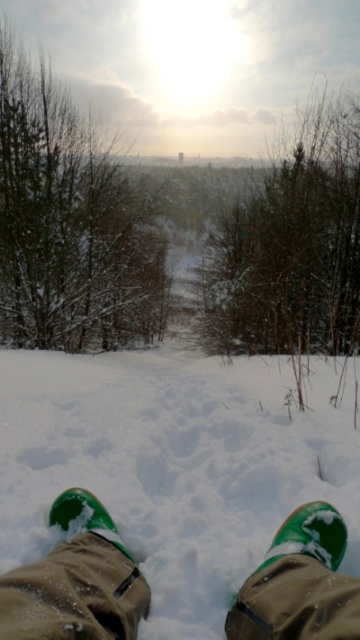
Question: Which of the following is the farthest from the observer?

Choices:
 (A) green suede boot at lower center
 (B) green suede boots at lower center

Answer: (A)

Question: Observing the image, what is the correct spatial positioning of green suede boots at lower center in reference to green suede shoe at lower center?

Choices:
 (A) above
 (B) below

Answer: (A)

Question: Which point is closer to the camera?

Choices:
 (A) green suede boots at lower center
 (B) green suede shoe at lower center

Answer: (A)

Question: Which object is the closest to the green suede boot at lower center?

Choices:
 (A) green suede boots at lower center
 (B) green suede shoe at lower center

Answer: (A)

Question: Does green suede boots at lower center appear under green suede boot at lower center?

Choices:
 (A) no
 (B) yes

Answer: (A)

Question: Is green suede shoe at lower center further to camera compared to green suede boot at lower center?

Choices:
 (A) yes
 (B) no

Answer: (B)